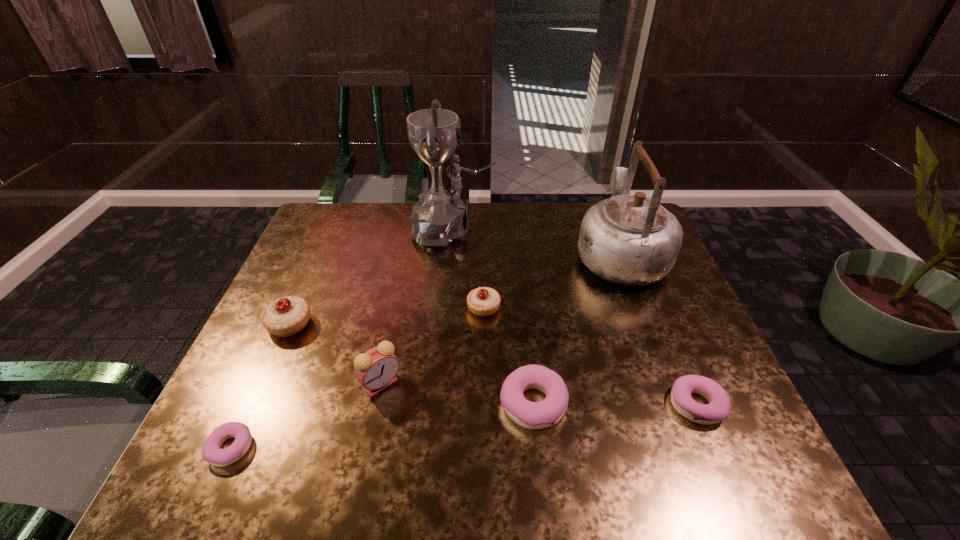
Where is `the second biggest pink pastry`? The image size is (960, 540). the second biggest pink pastry is located at coordinates (718, 409).

Identify the location of the second shortest pastry. This screenshot has width=960, height=540. (718, 409).

At what (x,y) coordinates should I click in order to perform the action: click on the smallest pink pastry. Please return your answer as a coordinate pair (x, y). This screenshot has height=540, width=960. Looking at the image, I should click on (212, 453).

Locate an element on the screen. The width and height of the screenshot is (960, 540). the shortest object is located at coordinates (212, 453).

This screenshot has height=540, width=960. I want to click on vacant space located on the side with emblem of the award, so pos(566,230).

At what (x,y) coordinates should I click in order to perform the action: click on vacant region located at the spout of the seventh shortest object. Please return your answer as a coordinate pair (x, y). Looking at the image, I should click on (600, 202).

This screenshot has width=960, height=540. I want to click on vacant space located 0.120m at the spout of the seventh shortest object, so click(x=600, y=204).

Find the location of a particular element. vacant space located on the face of the alarm clock is located at coordinates (372, 429).

I want to click on vacant region located 0.260m on the right of the left beige pastry, so click(413, 324).

Find the location of `vacant space located on the right of the right beige pastry`. vacant space located on the right of the right beige pastry is located at coordinates (601, 308).